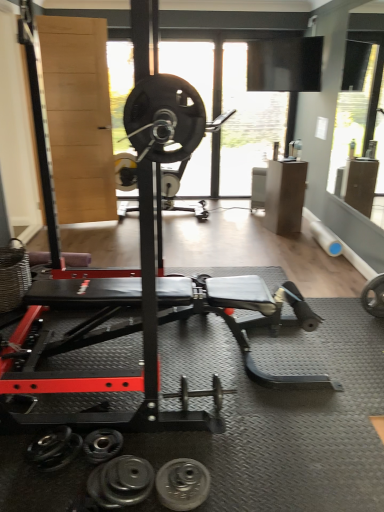
Identify the location of blank space situated above black rubber weight plate at lower center (from a real-world perspective). The height and width of the screenshot is (512, 384). (184, 490).